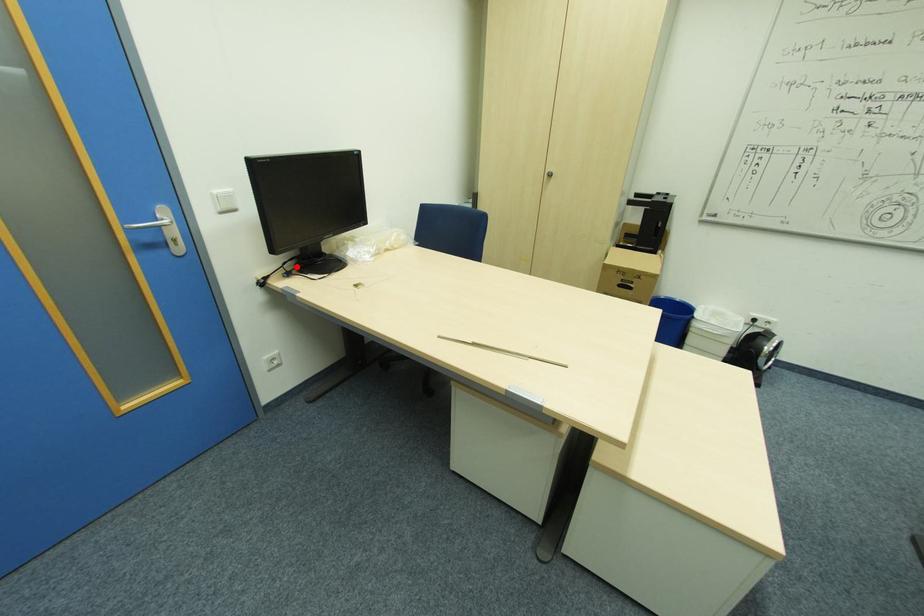
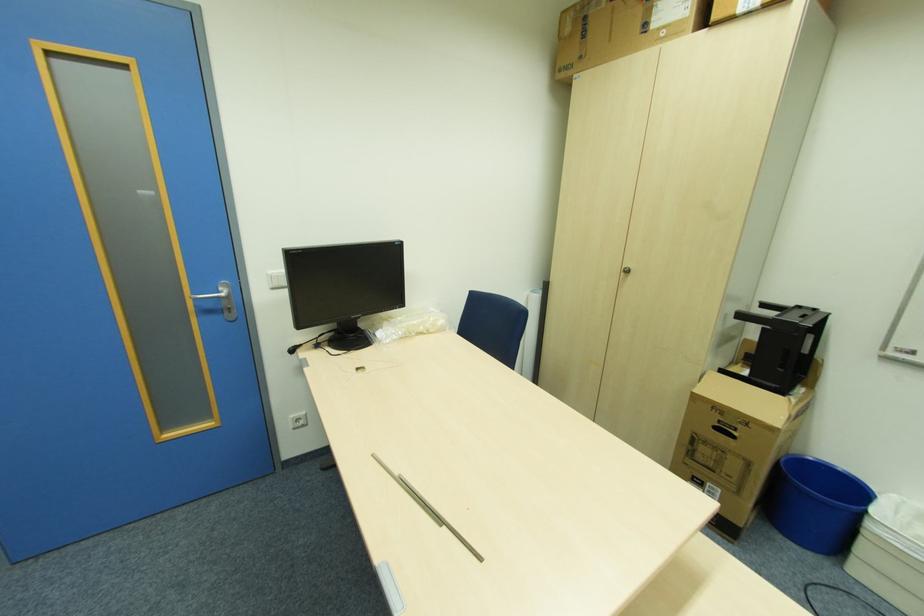
Locate, in the second image, the point that corresponds to the highlighted location in the first image.

(330, 339)